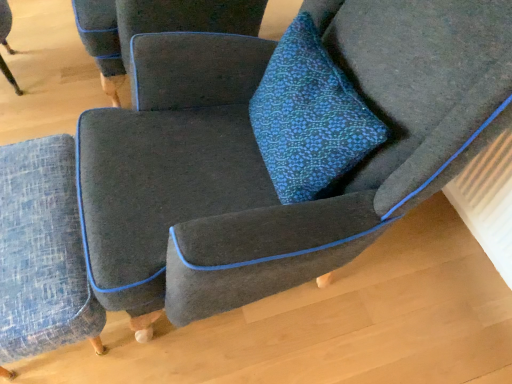
What is the approximate width of blue textured cushion at center?

8.17 inches.

This screenshot has height=384, width=512. Describe the element at coordinates (42, 252) in the screenshot. I see `blue textured ottoman at lower left, which is counted as the 1th chair, starting from the bottom` at that location.

The image size is (512, 384). Find the location of `blue textured cushion at center`. blue textured cushion at center is located at coordinates (310, 117).

Could you tell me if blue textured cushion at center is facing textured gray armchair at center, which appears as the 2th chair when ordered from the bottom?

No, blue textured cushion at center is not oriented towards textured gray armchair at center, which appears as the 2th chair when ordered from the bottom.

Would you say blue textured cushion at center is a long distance from textured gray armchair at center, the 1th chair when ordered from top to bottom?

No, there isn't a large distance between blue textured cushion at center and textured gray armchair at center, the 1th chair when ordered from top to bottom.

From the image's perspective, relative to textured gray armchair at center, the 1th chair when ordered from top to bottom, is blue textured cushion at center above or below?

Clearly, from the image's perspective, blue textured cushion at center is below textured gray armchair at center, the 1th chair when ordered from top to bottom.

In the image, is blue textured cushion at center positioned in front of or behind textured gray armchair at center, which appears as the 2th chair when ordered from the bottom?

Clearly, blue textured cushion at center is in front of textured gray armchair at center, which appears as the 2th chair when ordered from the bottom.

Choose the correct answer: Is blue textured cushion at center inside blue textured ottoman at lower left, which is counted as the 1th chair, starting from the bottom, or outside it?

blue textured cushion at center is located beyond the bounds of blue textured ottoman at lower left, which is counted as the 1th chair, starting from the bottom.

Are blue textured cushion at center and blue textured ottoman at lower left, which is counted as the 1th chair, starting from the bottom, beside each other?

No, blue textured cushion at center is not in contact with blue textured ottoman at lower left, which is counted as the 1th chair, starting from the bottom.

Is blue textured cushion at center wider or thinner than blue textured ottoman at lower left, which is counted as the 1th chair, starting from the bottom?

Considering their sizes, blue textured cushion at center looks slimmer than blue textured ottoman at lower left, which is counted as the 1th chair, starting from the bottom.

Locate an element on the screen. This screenshot has height=384, width=512. throw pillow above the blue textured ottoman at lower left, which is counted as the 1th chair, starting from the bottom (from the image's perspective) is located at coordinates (310, 117).

In terms of size, does textured gray armchair at center, which appears as the 2th chair when ordered from the bottom, appear bigger or smaller than blue textured cushion at center?

In the image, textured gray armchair at center, which appears as the 2th chair when ordered from the bottom, appears to be larger than blue textured cushion at center.

From the picture: Considering the positions of objects textured gray armchair at center, the 1th chair when ordered from top to bottom, and blue textured cushion at center in the image provided, who is in front, textured gray armchair at center, the 1th chair when ordered from top to bottom, or blue textured cushion at center?

blue textured cushion at center is in front.

Is textured gray armchair at center, which appears as the 2th chair when ordered from the bottom, not near blue textured cushion at center?

That's not correct — textured gray armchair at center, which appears as the 2th chair when ordered from the bottom, is a little close to blue textured cushion at center.

Could you tell me if textured gray armchair at center, which appears as the 2th chair when ordered from the bottom, is facing blue textured cushion at center?

No, textured gray armchair at center, which appears as the 2th chair when ordered from the bottom, is not facing towards blue textured cushion at center.

Does blue textured ottoman at lower left, the second chair positioned from the top, turn towards textured gray armchair at center, which appears as the 2th chair when ordered from the bottom?

No, blue textured ottoman at lower left, the second chair positioned from the top, is not turned towards textured gray armchair at center, which appears as the 2th chair when ordered from the bottom.

Locate an element on the screen. This screenshot has height=384, width=512. chair lying above the blue textured ottoman at lower left, the second chair positioned from the top (from the image's perspective) is located at coordinates (154, 26).

From their relative heights in the image, would you say blue textured ottoman at lower left, which is counted as the 1th chair, starting from the bottom, is taller or shorter than textured gray armchair at center, the 1th chair when ordered from top to bottom?

Considering their sizes, blue textured ottoman at lower left, which is counted as the 1th chair, starting from the bottom, has less height than textured gray armchair at center, the 1th chair when ordered from top to bottom.

From a real-world perspective, relative to textured gray armchair at center, the 1th chair when ordered from top to bottom, is blue textured ottoman at lower left, which is counted as the 1th chair, starting from the bottom, vertically above or below?

In terms of real-world spatial position, blue textured ottoman at lower left, which is counted as the 1th chair, starting from the bottom, is below textured gray armchair at center, the 1th chair when ordered from top to bottom.

In the scene shown: Is blue textured ottoman at lower left, the second chair positioned from the top, positioned far away from blue textured cushion at center?

No, there isn't a large distance between blue textured ottoman at lower left, the second chair positioned from the top, and blue textured cushion at center.

Is blue textured cushion at center at the back of blue textured ottoman at lower left, the second chair positioned from the top?

Yes, blue textured ottoman at lower left, the second chair positioned from the top, is positioned with its back facing blue textured cushion at center.

Could blue textured cushion at center be considered to be inside blue textured ottoman at lower left, which is counted as the 1th chair, starting from the bottom?

Actually, blue textured cushion at center is outside blue textured ottoman at lower left, which is counted as the 1th chair, starting from the bottom.

From a real-world perspective, which is physically below, blue textured ottoman at lower left, the second chair positioned from the top, or blue textured cushion at center?

blue textured ottoman at lower left, the second chair positioned from the top.

Which object is closer to the camera taking this photo, textured gray armchair at center, the 1th chair when ordered from top to bottom, or blue textured ottoman at lower left, the second chair positioned from the top?

Positioned in front is blue textured ottoman at lower left, the second chair positioned from the top.

Considering the sizes of objects textured gray armchair at center, which appears as the 2th chair when ordered from the bottom, and blue textured ottoman at lower left, which is counted as the 1th chair, starting from the bottom, in the image provided, who is smaller, textured gray armchair at center, which appears as the 2th chair when ordered from the bottom, or blue textured ottoman at lower left, which is counted as the 1th chair, starting from the bottom,?

Smaller between the two is blue textured ottoman at lower left, which is counted as the 1th chair, starting from the bottom.

From the picture: Which of these two, textured gray armchair at center, the 1th chair when ordered from top to bottom, or blue textured ottoman at lower left, which is counted as the 1th chair, starting from the bottom, stands shorter?

Standing shorter between the two is blue textured ottoman at lower left, which is counted as the 1th chair, starting from the bottom.

From the image's perspective, is textured gray armchair at center, the 1th chair when ordered from top to bottom, positioned above or below blue textured ottoman at lower left, the second chair positioned from the top?

From the image's perspective, textured gray armchair at center, the 1th chair when ordered from top to bottom, appears above blue textured ottoman at lower left, the second chair positioned from the top.

In the image, there is a textured gray armchair at center, the 1th chair when ordered from top to bottom. Identify the location of throw pillow below it (from the image's perspective). Image resolution: width=512 pixels, height=384 pixels. click(x=310, y=117).

Find the location of a particular element. Image resolution: width=512 pixels, height=384 pixels. throw pillow on the right of blue textured ottoman at lower left, the second chair positioned from the top is located at coordinates (310, 117).

Considering their positions, is blue textured cushion at center positioned closer to blue textured ottoman at lower left, which is counted as the 1th chair, starting from the bottom, than textured gray armchair at center, which appears as the 2th chair when ordered from the bottom?

textured gray armchair at center, which appears as the 2th chair when ordered from the bottom, is positioned closer to the anchor blue textured ottoman at lower left, which is counted as the 1th chair, starting from the bottom.

Looking at the image, which one is located closer to textured gray armchair at center, which appears as the 2th chair when ordered from the bottom, blue textured ottoman at lower left, the second chair positioned from the top, or blue textured cushion at center?

Among the two, blue textured ottoman at lower left, the second chair positioned from the top, is located nearer to textured gray armchair at center, which appears as the 2th chair when ordered from the bottom.

Consider the image. When comparing their distances from blue textured ottoman at lower left, the second chair positioned from the top, does textured gray armchair at center, which appears as the 2th chair when ordered from the bottom, or blue textured cushion at center seem further?

blue textured cushion at center is positioned further to the anchor blue textured ottoman at lower left, the second chair positioned from the top.

Based on the photo, estimate the real-world distances between objects in this image. Which object is closer to blue textured cushion at center, blue textured ottoman at lower left, the second chair positioned from the top, or textured gray armchair at center, which appears as the 2th chair when ordered from the bottom?

Based on the image, blue textured ottoman at lower left, the second chair positioned from the top, appears to be nearer to blue textured cushion at center.

Which object lies nearer to the anchor point textured gray armchair at center, the 1th chair when ordered from top to bottom, blue textured cushion at center or blue textured ottoman at lower left, which is counted as the 1th chair, starting from the bottom?

blue textured ottoman at lower left, which is counted as the 1th chair, starting from the bottom, is positioned closer to the anchor textured gray armchair at center, the 1th chair when ordered from top to bottom.

When comparing their distances from blue textured cushion at center, does textured gray armchair at center, the 1th chair when ordered from top to bottom, or blue textured ottoman at lower left, which is counted as the 1th chair, starting from the bottom, seem closer?

blue textured ottoman at lower left, which is counted as the 1th chair, starting from the bottom, is positioned closer to the anchor blue textured cushion at center.

Where is `throw pillow between textured gray armchair at center, which appears as the 2th chair when ordered from the bottom, and blue textured ottoman at lower left, the second chair positioned from the top, vertically`? throw pillow between textured gray armchair at center, which appears as the 2th chair when ordered from the bottom, and blue textured ottoman at lower left, the second chair positioned from the top, vertically is located at coordinates (310, 117).